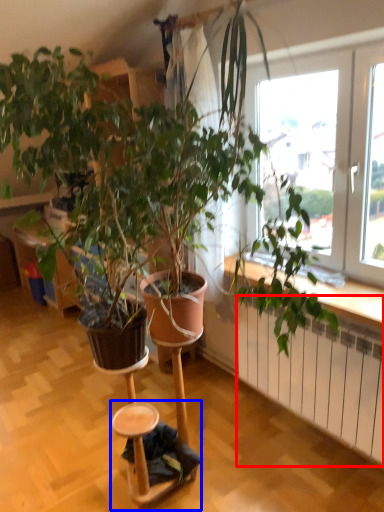
Question: Which point is closer to the camera, radiator (highlighted by a red box) or step stool (highlighted by a blue box)?

Choices:
 (A) radiator
 (B) step stool

Answer: (A)